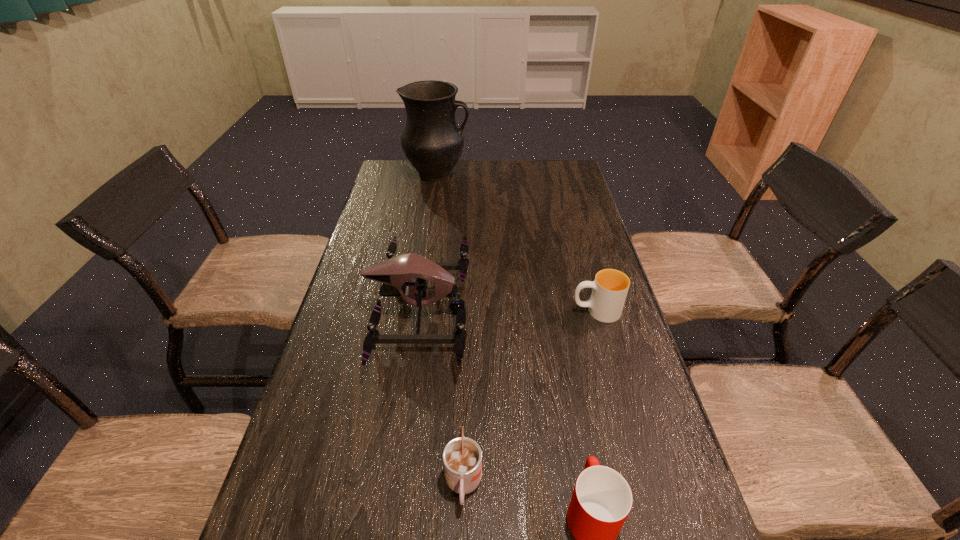
Locate an element on the screen. This screenshot has width=960, height=540. the tallest object is located at coordinates (432, 141).

This screenshot has width=960, height=540. In order to click on pitcher in this screenshot , I will do `click(432, 141)`.

This screenshot has width=960, height=540. What are the coordinates of `drone` in the screenshot? It's located at (395, 274).

The image size is (960, 540). What are the coordinates of `the leftmost cup` in the screenshot? It's located at (462, 457).

Where is `the farthest cup`? The height and width of the screenshot is (540, 960). the farthest cup is located at coordinates (610, 287).

Locate an element on the screen. The height and width of the screenshot is (540, 960). blank area located on the handle side of the farthest object is located at coordinates (523, 174).

This screenshot has width=960, height=540. What are the coordinates of `free space located 0.240m on the front-facing side of the second tallest object` in the screenshot? It's located at (559, 310).

Identify the location of free region located with the handle on the side of the farthest cup. The width and height of the screenshot is (960, 540). (470, 311).

Locate an element on the screen. The height and width of the screenshot is (540, 960). free point located with the handle on the side of the farthest cup is located at coordinates 518,311.

At what (x,y) coordinates should I click in order to perform the action: click on free region located 0.390m with the handle on the side of the farthest cup. Please return your answer as a coordinate pair (x, y). Looking at the image, I should click on (425, 311).